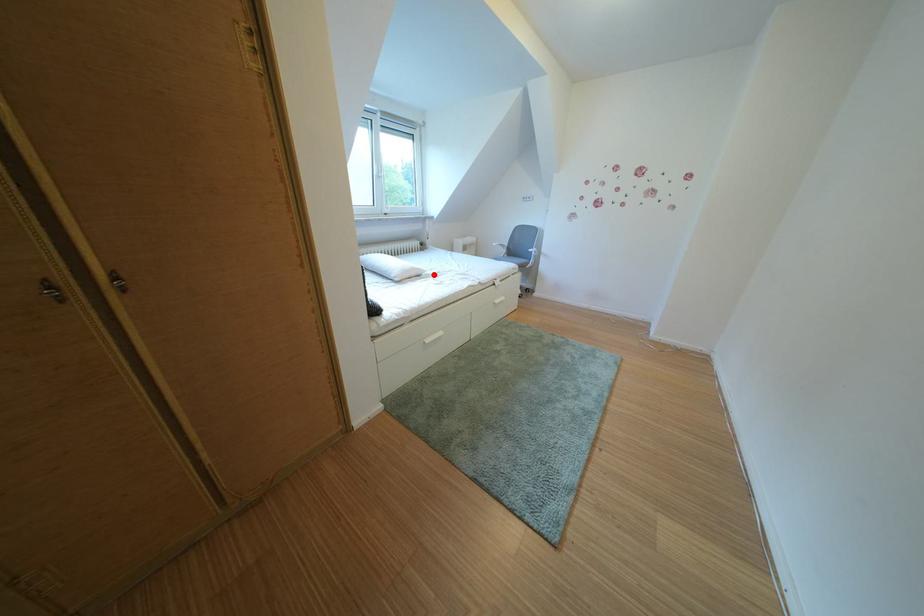
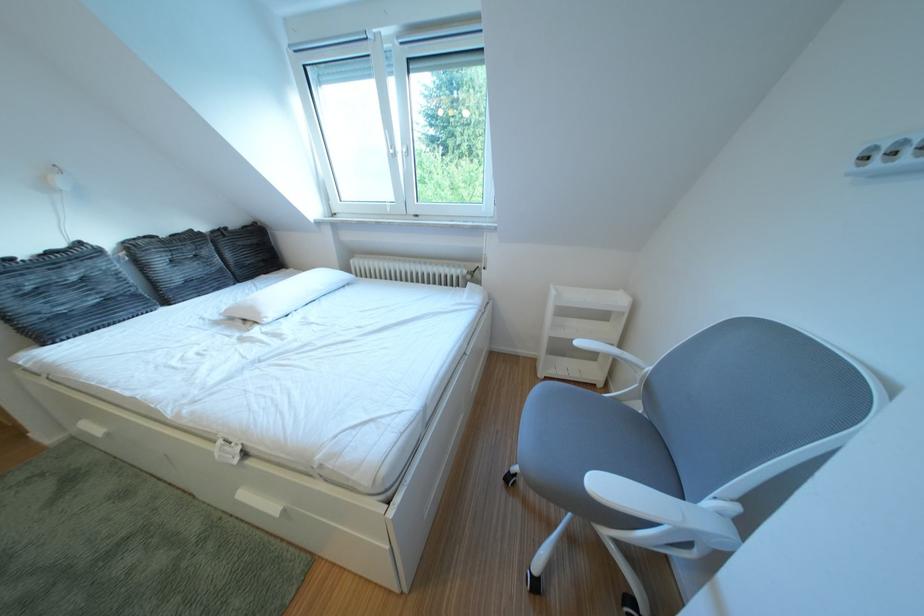
In the second image, find the point that corresponds to the highlighted location in the first image.

(273, 318)